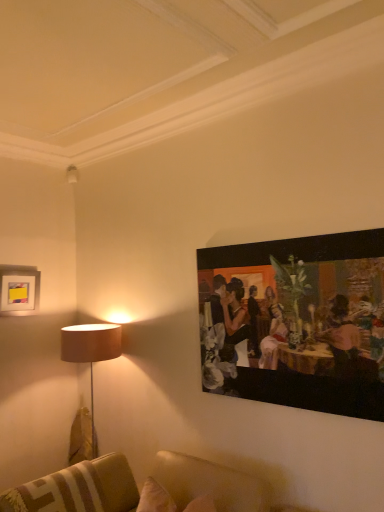
The height and width of the screenshot is (512, 384). Describe the element at coordinates (78, 489) in the screenshot. I see `leather couch at lower center` at that location.

Identify the location of leather couch at lower center. This screenshot has height=512, width=384. (78, 489).

Locate an element on the screen. oil painting at upper right, which is the 2th picture frame in back-to-front order is located at coordinates (297, 322).

How much space does oil painting at upper right, which is the 2th picture frame in back-to-front order, occupy vertically?

oil painting at upper right, which is the 2th picture frame in back-to-front order, is 35.22 inches in height.

At what (x,y) coordinates should I click in order to perform the action: click on leather couch at lower center. Please return your answer as a coordinate pair (x, y). The width and height of the screenshot is (384, 512). Looking at the image, I should click on tap(78, 489).

Between matte white picture frame at upper left, which is the first picture frame in left-to-right order, and leather couch at lower center, which one has smaller width?

matte white picture frame at upper left, which is the first picture frame in left-to-right order, is thinner.

Based on the photo, from a real-world perspective, is matte white picture frame at upper left, which is the first picture frame in left-to-right order, positioned above or below leather couch at lower center?

Clearly, from a real-world perspective, matte white picture frame at upper left, which is the first picture frame in left-to-right order, is above leather couch at lower center.

The height and width of the screenshot is (512, 384). Find the location of `the 2nd picture frame above the leather couch at lower center (from the image's perspective)`. the 2nd picture frame above the leather couch at lower center (from the image's perspective) is located at coordinates (19, 290).

Identify the location of the 1st picture frame positioned above the leather couch at lower center (from a real-world perspective). (297, 322).

Which is in front, point (39, 483) or point (356, 252)?

The point (356, 252) is in front.

In the scene shown: Could you tell me if leather couch at lower center is turned towards oil painting at upper right, which is the 2th picture frame in back-to-front order?

No, leather couch at lower center is not facing towards oil painting at upper right, which is the 2th picture frame in back-to-front order.

From a real-world perspective, who is located lower, leather couch at lower center or oil painting at upper right, which is the 2th picture frame in back-to-front order?

From a 3D spatial view, leather couch at lower center is below.

Is leather couch at lower center a part of oil painting at upper right, the first picture frame when ordered from right to left?

That's incorrect, leather couch at lower center is not inside oil painting at upper right, the first picture frame when ordered from right to left.

From a real-world perspective, does oil painting at upper right, which is the 2th picture frame in back-to-front order, sit lower than leather couch at lower center?

No.

Which object is wider, oil painting at upper right, the first picture frame when ordered from right to left, or leather couch at lower center?

leather couch at lower center.

Does matte white picture frame at upper left, the 2th picture frame in the right-to-left sequence, have a greater width compared to oil painting at upper right, which is the 2th picture frame in back-to-front order?

Yes.

Which point is more distant from viewer, (19, 307) or (277, 316)?

The point (19, 307) is farther.

From a real-world perspective, does matte white picture frame at upper left, which ranks as the 2th picture frame in front-to-back order, sit lower than oil painting at upper right, which is the 2th picture frame in back-to-front order?

Incorrect, from a real-world perspective, matte white picture frame at upper left, which ranks as the 2th picture frame in front-to-back order, is higher than oil painting at upper right, which is the 2th picture frame in back-to-front order.

Is matte white picture frame at upper left, marked as the 1th picture frame in a back-to-front arrangement, next to oil painting at upper right, which is the 2th picture frame in left-to-right order, and touching it?

No, matte white picture frame at upper left, marked as the 1th picture frame in a back-to-front arrangement, is not touching oil painting at upper right, which is the 2th picture frame in left-to-right order.

Between oil painting at upper right, which is the 2th picture frame in left-to-right order, and matte white picture frame at upper left, marked as the 1th picture frame in a back-to-front arrangement, which one has larger width?

matte white picture frame at upper left, marked as the 1th picture frame in a back-to-front arrangement, is wider.

What's the angular difference between oil painting at upper right, which is the 2th picture frame in left-to-right order, and matte white picture frame at upper left, which is the first picture frame in left-to-right order,'s facing directions?

The angle between the facing direction of oil painting at upper right, which is the 2th picture frame in left-to-right order, and the facing direction of matte white picture frame at upper left, which is the first picture frame in left-to-right order, is 93.5 degrees.

In the scene shown: Considering the sizes of objects oil painting at upper right, which is the 2th picture frame in back-to-front order, and matte white picture frame at upper left, marked as the 1th picture frame in a back-to-front arrangement, in the image provided, who is taller, oil painting at upper right, which is the 2th picture frame in back-to-front order, or matte white picture frame at upper left, marked as the 1th picture frame in a back-to-front arrangement,?

oil painting at upper right, which is the 2th picture frame in back-to-front order, is taller.

In the image, is oil painting at upper right, which is the 2th picture frame in left-to-right order, positioned in front of or behind matte white picture frame at upper left, marked as the 1th picture frame in a back-to-front arrangement?

oil painting at upper right, which is the 2th picture frame in left-to-right order, is in front of matte white picture frame at upper left, marked as the 1th picture frame in a back-to-front arrangement.

Looking at their sizes, would you say leather couch at lower center is wider or thinner than matte white picture frame at upper left, marked as the 1th picture frame in a back-to-front arrangement?

Considering their sizes, leather couch at lower center looks broader than matte white picture frame at upper left, marked as the 1th picture frame in a back-to-front arrangement.

Which object is closer to the camera, leather couch at lower center or matte white picture frame at upper left, marked as the 1th picture frame in a back-to-front arrangement?

Positioned in front is leather couch at lower center.

Does leather couch at lower center have a lesser height compared to matte white picture frame at upper left, marked as the 1th picture frame in a back-to-front arrangement?

Yes, leather couch at lower center is shorter than matte white picture frame at upper left, marked as the 1th picture frame in a back-to-front arrangement.

Choose the correct answer: Is leather couch at lower center inside matte white picture frame at upper left, marked as the 1th picture frame in a back-to-front arrangement, or outside it?

leather couch at lower center is not enclosed by matte white picture frame at upper left, marked as the 1th picture frame in a back-to-front arrangement.

Locate an element on the screen. The image size is (384, 512). picture frame that is the 2nd object located behind the leather couch at lower center is located at coordinates (19, 290).

Identify the location of studio couch to the left of oil painting at upper right, which is the 2th picture frame in left-to-right order. This screenshot has height=512, width=384. (78, 489).

Based on their spatial positions, is matte white picture frame at upper left, the 2th picture frame in the right-to-left sequence, or oil painting at upper right, the first picture frame when ordered from right to left, closer to leather couch at lower center?

The object closer to leather couch at lower center is oil painting at upper right, the first picture frame when ordered from right to left.

Considering their positions, is leather couch at lower center positioned further to oil painting at upper right, the first picture frame when ordered from front to back, than matte white picture frame at upper left, which is the first picture frame in left-to-right order?

Based on the image, matte white picture frame at upper left, which is the first picture frame in left-to-right order, appears to be further to oil painting at upper right, the first picture frame when ordered from front to back.

Looking at the image, which one is located closer to matte white picture frame at upper left, which ranks as the 2th picture frame in front-to-back order, leather couch at lower center or oil painting at upper right, which is the 2th picture frame in left-to-right order?

Based on the image, leather couch at lower center appears to be nearer to matte white picture frame at upper left, which ranks as the 2th picture frame in front-to-back order.

Based on the photo, looking at the image, which one is located closer to matte white picture frame at upper left, which is the first picture frame in left-to-right order, oil painting at upper right, the first picture frame when ordered from front to back, or leather couch at lower center?

leather couch at lower center is closer to matte white picture frame at upper left, which is the first picture frame in left-to-right order.

When comparing their distances from leather couch at lower center, does oil painting at upper right, the first picture frame when ordered from right to left, or matte white picture frame at upper left, which ranks as the 2th picture frame in front-to-back order, seem closer?

oil painting at upper right, the first picture frame when ordered from right to left.

When comparing their distances from oil painting at upper right, the first picture frame when ordered from right to left, does matte white picture frame at upper left, which ranks as the 2th picture frame in front-to-back order, or leather couch at lower center seem closer?

leather couch at lower center is positioned closer to the anchor oil painting at upper right, the first picture frame when ordered from right to left.

Where is `studio couch between matte white picture frame at upper left, which is the first picture frame in left-to-right order, and oil painting at upper right, which is the 2th picture frame in left-to-right order, from left to right`? studio couch between matte white picture frame at upper left, which is the first picture frame in left-to-right order, and oil painting at upper right, which is the 2th picture frame in left-to-right order, from left to right is located at coordinates (78, 489).